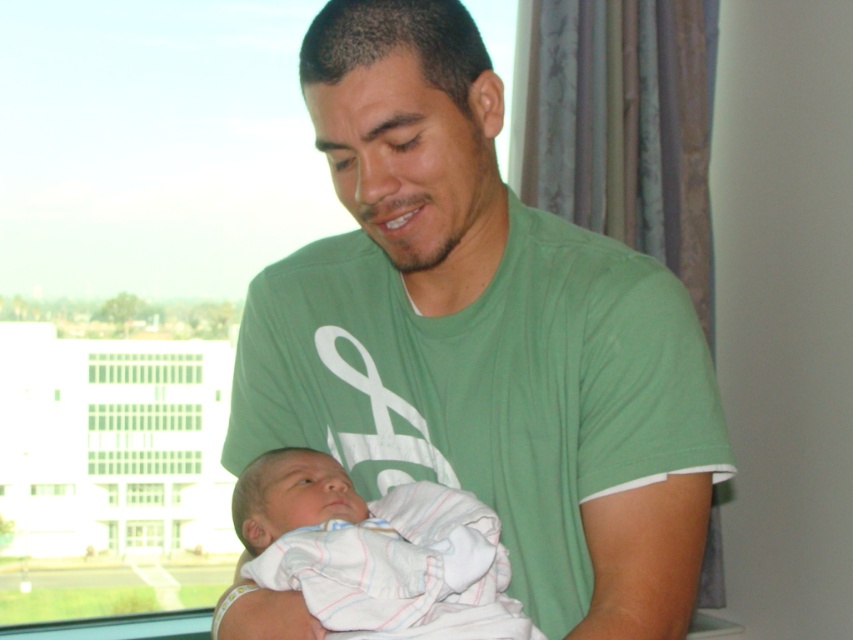
Question: Which of the following is the farthest from the observer?

Choices:
 (A) (367, 568)
 (B) (418, 241)

Answer: (B)

Question: Can you confirm if green cotton shirt at center is wider than white striped cloth at center?

Choices:
 (A) yes
 (B) no

Answer: (A)

Question: Does green cotton shirt at center have a lesser width compared to white striped cloth at center?

Choices:
 (A) yes
 (B) no

Answer: (B)

Question: Is green cotton shirt at center behind white striped cloth at center?

Choices:
 (A) yes
 (B) no

Answer: (A)